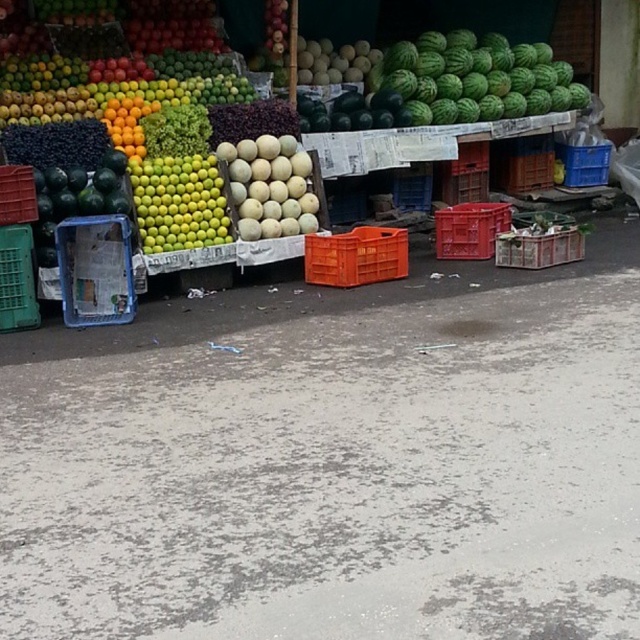
Question: Considering the relative positions of green plastic crate at left and matte plastic crate at left in the image provided, where is green plastic crate at left located with respect to matte plastic crate at left?

Choices:
 (A) below
 (B) above

Answer: (A)

Question: Which point is closer to the camera taking this photo?

Choices:
 (A) (582, 248)
 (B) (428, 38)
 (C) (218, 240)

Answer: (C)

Question: Among these points, which one is farthest from the camera?

Choices:
 (A) (508, 227)
 (B) (275, 145)
 (C) (604, 179)
 (D) (188, 176)

Answer: (C)

Question: Which point is closer to the camera?

Choices:
 (A) green matte melon at center
 (B) red plastic crate at center
 (C) orange plastic crate at center

Answer: (A)

Question: Can you confirm if smooth yellow melons at center is smaller than blue plastic crate at right?

Choices:
 (A) no
 (B) yes

Answer: (A)

Question: Is green matte melon at center below red plastic crate at center?

Choices:
 (A) no
 (B) yes

Answer: (A)